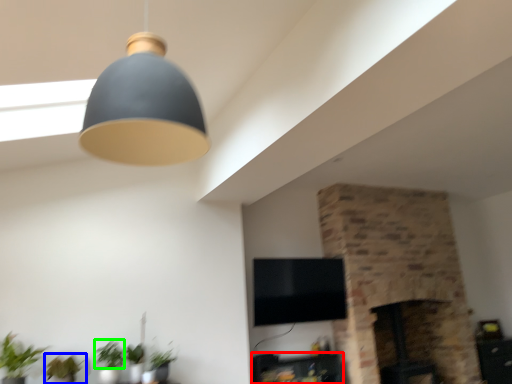
Question: Which object is positioned farthest from furniture (highlighted by a red box)? Select from plant (highlighted by a blue box) and plant (highlighted by a green box).

Choices:
 (A) plant
 (B) plant

Answer: (A)